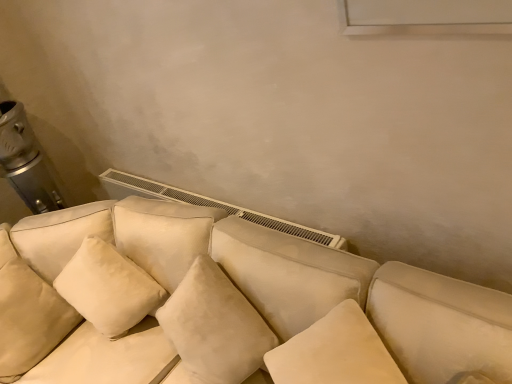
Describe the element at coordinates (28, 314) in the screenshot. This screenshot has height=384, width=512. I see `suede-like beige pillow at lower left` at that location.

Find the location of `suede-like beige pillow at lower left`. suede-like beige pillow at lower left is located at coordinates (28, 314).

What is the approximate height of suede-like beige pillow at lower left?

suede-like beige pillow at lower left is 19.51 inches tall.

Based on the photo, what is the approximate height of suede-like beige couch at center?

The height of suede-like beige couch at center is 31.04 inches.

Describe the element at coordinates (228, 305) in the screenshot. The width and height of the screenshot is (512, 384). I see `suede-like beige couch at center` at that location.

Image resolution: width=512 pixels, height=384 pixels. Identify the location of suede-like beige couch at center. (228, 305).

In order to face suede-like beige couch at center, should I rotate leftwards or rightwards?

Turn right approximately 7.004 degrees to face it.

This screenshot has height=384, width=512. Find the location of `suede-like beige pillow at lower left`. suede-like beige pillow at lower left is located at coordinates (28, 314).

Which object is positioned more to the right, suede-like beige pillow at lower left or suede-like beige couch at center?

From the viewer's perspective, suede-like beige couch at center appears more on the right side.

Is suede-like beige pillow at lower left positioned in front of suede-like beige couch at center?

No, suede-like beige pillow at lower left is further to the viewer.

Which is in front, point (3, 240) or point (52, 348)?

Point (52, 348)

From the image's perspective, which one is positioned lower, suede-like beige pillow at lower left or suede-like beige couch at center?

suede-like beige couch at center.

From a real-world perspective, is suede-like beige pillow at lower left above or below suede-like beige couch at center?

suede-like beige pillow at lower left is above suede-like beige couch at center.

Considering the relative sizes of suede-like beige pillow at lower left and suede-like beige couch at center in the image provided, is suede-like beige pillow at lower left thinner than suede-like beige couch at center?

Indeed, suede-like beige pillow at lower left has a lesser width compared to suede-like beige couch at center.

Who is shorter, suede-like beige pillow at lower left or suede-like beige couch at center?

suede-like beige pillow at lower left.

Considering the sizes of objects suede-like beige pillow at lower left and suede-like beige couch at center in the image provided, who is bigger, suede-like beige pillow at lower left or suede-like beige couch at center?

Bigger between the two is suede-like beige couch at center.

Is suede-like beige pillow at lower left situated inside suede-like beige couch at center or outside?

suede-like beige pillow at lower left is located beyond the bounds of suede-like beige couch at center.

Based on the photo, is suede-like beige pillow at lower left with suede-like beige couch at center?

suede-like beige pillow at lower left is not next to suede-like beige couch at center, and they're not touching.

Is suede-like beige pillow at lower left turned away from suede-like beige couch at center?

suede-like beige pillow at lower left does not have its back to suede-like beige couch at center.

Where is `studio couch beneath the suede-like beige pillow at lower left (from a real-world perspective)`? This screenshot has width=512, height=384. studio couch beneath the suede-like beige pillow at lower left (from a real-world perspective) is located at coordinates (228, 305).

Which is more to the right, suede-like beige couch at center or suede-like beige pillow at lower left?

suede-like beige couch at center.

Is suede-like beige couch at center positioned before suede-like beige pillow at lower left?

Yes, it is in front of suede-like beige pillow at lower left.

Does point (480, 327) appear closer or farther from the camera than point (40, 336)?

Point (480, 327) is positioned closer to the camera compared to point (40, 336).

From the image's perspective, is suede-like beige couch at center above or below suede-like beige pillow at lower left?

From the image's perspective, suede-like beige couch at center appears below suede-like beige pillow at lower left.

From a real-world perspective, is suede-like beige couch at center on suede-like beige pillow at lower left?

No.

Which of these two, suede-like beige couch at center or suede-like beige pillow at lower left, is thinner?

suede-like beige pillow at lower left.

Between suede-like beige couch at center and suede-like beige pillow at lower left, which one has more height?

suede-like beige couch at center.

In the scene shown: Is suede-like beige couch at center bigger or smaller than suede-like beige pillow at lower left?

Clearly, suede-like beige couch at center is larger in size than suede-like beige pillow at lower left.

Is suede-like beige couch at center positioned beyond the bounds of suede-like beige pillow at lower left?

Indeed, suede-like beige couch at center is completely outside suede-like beige pillow at lower left.

Would you say suede-like beige couch at center is a long distance from suede-like beige pillow at lower left?

suede-like beige couch at center is actually quite close to suede-like beige pillow at lower left.

Is suede-like beige couch at center positioned with its back to suede-like beige pillow at lower left?

No, suede-like beige pillow at lower left is not at the back of suede-like beige couch at center.

Can you tell me how much suede-like beige couch at center and suede-like beige pillow at lower left differ in facing direction?

67.3 degrees separate the facing orientations of suede-like beige couch at center and suede-like beige pillow at lower left.

The image size is (512, 384). I want to click on studio couch that is on the right side of suede-like beige pillow at lower left, so click(x=228, y=305).

Image resolution: width=512 pixels, height=384 pixels. I want to click on studio couch below the suede-like beige pillow at lower left (from the image's perspective), so click(228, 305).

You are a GUI agent. You are given a task and a screenshot of the screen. Output one action in this format:
    pyautogui.click(x=<x>, y=<y>)
    Task: Click on the pillow above the suede-like beige couch at center (from a real-world perspective)
    This screenshot has width=512, height=384.
    Given the screenshot: What is the action you would take?
    pyautogui.click(x=28, y=314)